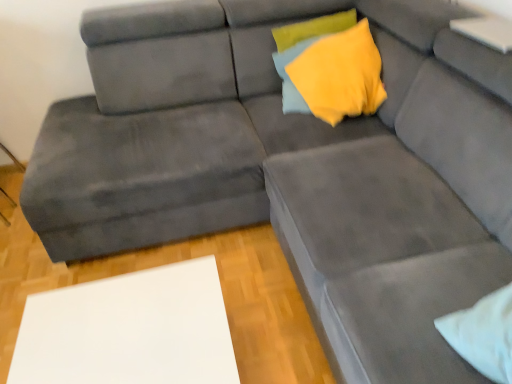
Describe the element at coordinates (129, 330) in the screenshot. I see `white matte table at lower left` at that location.

What are the coordinates of `white matte table at lower left` in the screenshot? It's located at (129, 330).

What do you see at coordinates (303, 50) in the screenshot? I see `yellow fabric pillow at upper center` at bounding box center [303, 50].

At what (x,y) coordinates should I click in order to perform the action: click on yellow fabric pillow at upper center. Please return your answer as a coordinate pair (x, y). The image size is (512, 384). Looking at the image, I should click on (303, 50).

The image size is (512, 384). In order to click on white matte table at lower left in this screenshot , I will do `click(129, 330)`.

Which object is positioned more to the left, white matte table at lower left or yellow fabric pillow at upper center?

Positioned to the left is white matte table at lower left.

Considering the relative positions of white matte table at lower left and yellow fabric pillow at upper center in the image provided, is white matte table at lower left in front of yellow fabric pillow at upper center?

Yes, white matte table at lower left is in front of yellow fabric pillow at upper center.

Which point is more distant from viewer, (128,345) or (282,97)?

The point (282,97) is farther.

From the image's perspective, relative to yellow fabric pillow at upper center, is white matte table at lower left above or below?

white matte table at lower left is below yellow fabric pillow at upper center.

From a real-world perspective, is white matte table at lower left physically below yellow fabric pillow at upper center?

Yes.

Can you confirm if white matte table at lower left is thinner than yellow fabric pillow at upper center?

No.

Which of these two, white matte table at lower left or yellow fabric pillow at upper center, stands taller?

white matte table at lower left is taller.

Considering the sizes of objects white matte table at lower left and yellow fabric pillow at upper center in the image provided, who is bigger, white matte table at lower left or yellow fabric pillow at upper center?

white matte table at lower left is bigger.

In the scene shown: Is white matte table at lower left not inside yellow fabric pillow at upper center?

Yes, white matte table at lower left is outside of yellow fabric pillow at upper center.

Are white matte table at lower left and yellow fabric pillow at upper center located far from each other?

Yes, white matte table at lower left and yellow fabric pillow at upper center are quite far apart.

Is white matte table at lower left oriented away from yellow fabric pillow at upper center?

No, white matte table at lower left's orientation is not away from yellow fabric pillow at upper center.

Can you tell me how much white matte table at lower left and yellow fabric pillow at upper center differ in facing direction?

They differ by 1.28 degrees in their facing directions.

You are a GUI agent. You are given a task and a screenshot of the screen. Output one action in this format:
    pyautogui.click(x=<x>, y=<y>)
    Task: Click on the pillow that is above the white matte table at lower left (from the image's perspective)
    The image size is (512, 384).
    Given the screenshot: What is the action you would take?
    pyautogui.click(x=303, y=50)

Is yellow fabric pillow at upper center at the right side of white matte table at lower left?

Correct, you'll find yellow fabric pillow at upper center to the right of white matte table at lower left.

In the image, is yellow fabric pillow at upper center positioned in front of or behind white matte table at lower left?

In the image, yellow fabric pillow at upper center appears behind white matte table at lower left.

Is point (303, 30) less distant than point (158, 268)?

No, it is behind (158, 268).

From the image's perspective, which object appears higher, yellow fabric pillow at upper center or white matte table at lower left?

yellow fabric pillow at upper center, from the image's perspective.

From a real-world perspective, is yellow fabric pillow at upper center physically located above or below white matte table at lower left?

In terms of real-world spatial position, yellow fabric pillow at upper center is above white matte table at lower left.

Can you confirm if yellow fabric pillow at upper center is thinner than white matte table at lower left?

Yes.

Considering the relative sizes of yellow fabric pillow at upper center and white matte table at lower left in the image provided, is yellow fabric pillow at upper center shorter than white matte table at lower left?

Yes, yellow fabric pillow at upper center is shorter than white matte table at lower left.

Based on their sizes in the image, would you say yellow fabric pillow at upper center is bigger or smaller than white matte table at lower left?

Clearly, yellow fabric pillow at upper center is smaller in size than white matte table at lower left.

Is yellow fabric pillow at upper center spatially inside white matte table at lower left, or outside of it?

yellow fabric pillow at upper center lies outside white matte table at lower left.

Is yellow fabric pillow at upper center in contact with white matte table at lower left?

No, yellow fabric pillow at upper center is not beside white matte table at lower left.

Does yellow fabric pillow at upper center turn towards white matte table at lower left?

No, yellow fabric pillow at upper center is not turned towards white matte table at lower left.

What's the angular difference between yellow fabric pillow at upper center and white matte table at lower left's facing directions?

The facing directions of yellow fabric pillow at upper center and white matte table at lower left are 1.28 degrees apart.

The width and height of the screenshot is (512, 384). What are the coordinates of `pillow above the white matte table at lower left (from the image's perspective)` in the screenshot? It's located at (303, 50).

In the image, there is a yellow fabric pillow at upper center. Identify the location of table below it (from the image's perspective). pyautogui.click(x=129, y=330).

At what (x,y) coordinates should I click in order to perform the action: click on pillow that is above the white matte table at lower left (from the image's perspective). Please return your answer as a coordinate pair (x, y). Image resolution: width=512 pixels, height=384 pixels. Looking at the image, I should click on (303, 50).